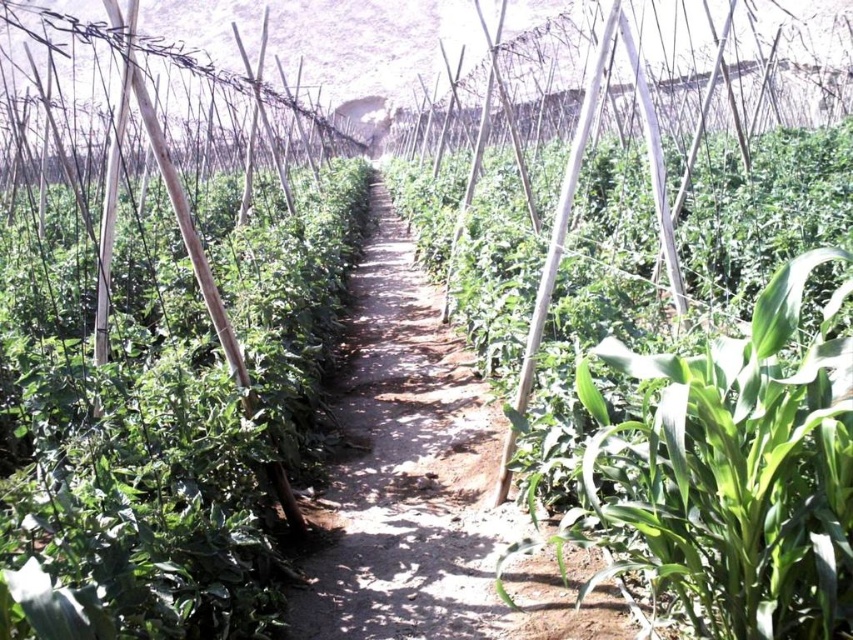
Is green leafy plant at center wider than dirt path at center?

In fact, green leafy plant at center might be narrower than dirt path at center.

Which is in front, point (735, 540) or point (357, 456)?

Positioned in front is point (735, 540).

Does point (775, 540) come farther from viewer compared to point (437, 333)?

No, it is not.

In order to click on green leafy plant at center in this screenshot , I will do `click(724, 474)`.